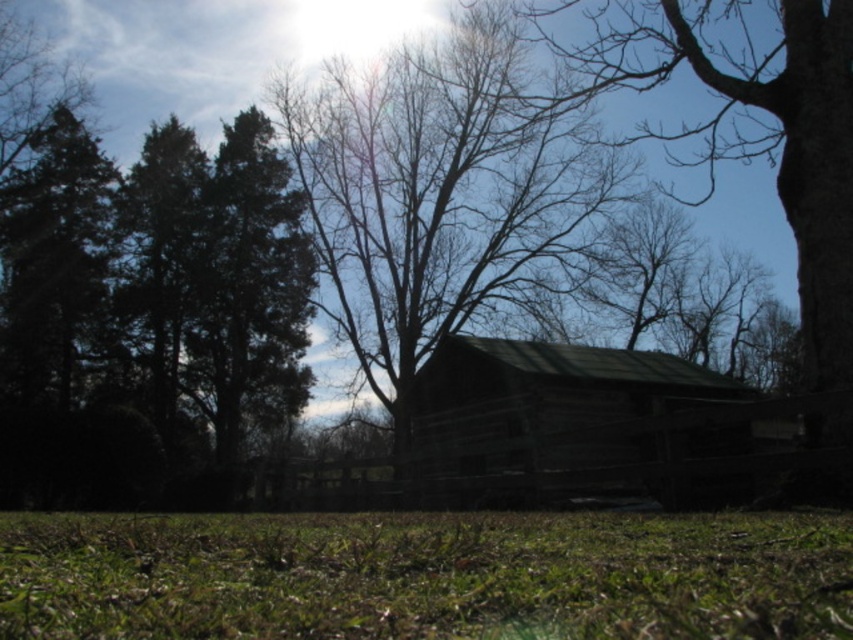
Between brown wood tree at center and dark brown wooden barn at center, which one appears on the left side from the viewer's perspective?

Positioned to the left is brown wood tree at center.

Is brown wood tree at center shorter than dark brown wooden barn at center?

In fact, brown wood tree at center may be taller than dark brown wooden barn at center.

Between point (428, 220) and point (465, 433), which one is positioned in front?

Point (465, 433)

The image size is (853, 640). Identify the location of brown wood tree at center. (440, 193).

This screenshot has width=853, height=640. I want to click on green grassy at lower center, so click(426, 576).

Based on the photo, can you confirm if green grassy at lower center is positioned above dark brown wooden barn at center?

Indeed, green grassy at lower center is positioned over dark brown wooden barn at center.

What do you see at coordinates (426, 576) in the screenshot? I see `green grassy at lower center` at bounding box center [426, 576].

At what (x,y) coordinates should I click in order to perform the action: click on green grassy at lower center. Please return your answer as a coordinate pair (x, y). Looking at the image, I should click on (426, 576).

Is green grassy at lower center to the left of brown wood tree at center from the viewer's perspective?

No, green grassy at lower center is not to the left of brown wood tree at center.

Can you confirm if green grassy at lower center is positioned to the right of brown wood tree at center?

Correct, you'll find green grassy at lower center to the right of brown wood tree at center.

Is point (332, 561) closer to viewer compared to point (361, 118)?

Yes.

This screenshot has width=853, height=640. Identify the location of green grassy at lower center. (426, 576).